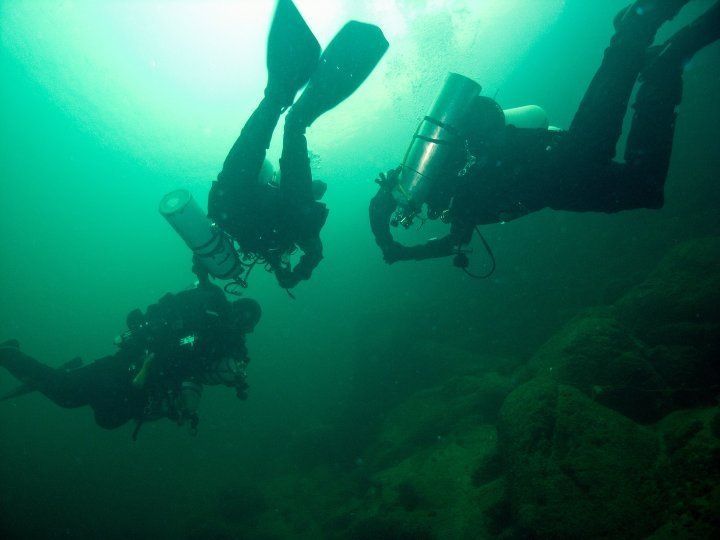
Identify the location of light. (227, 22).